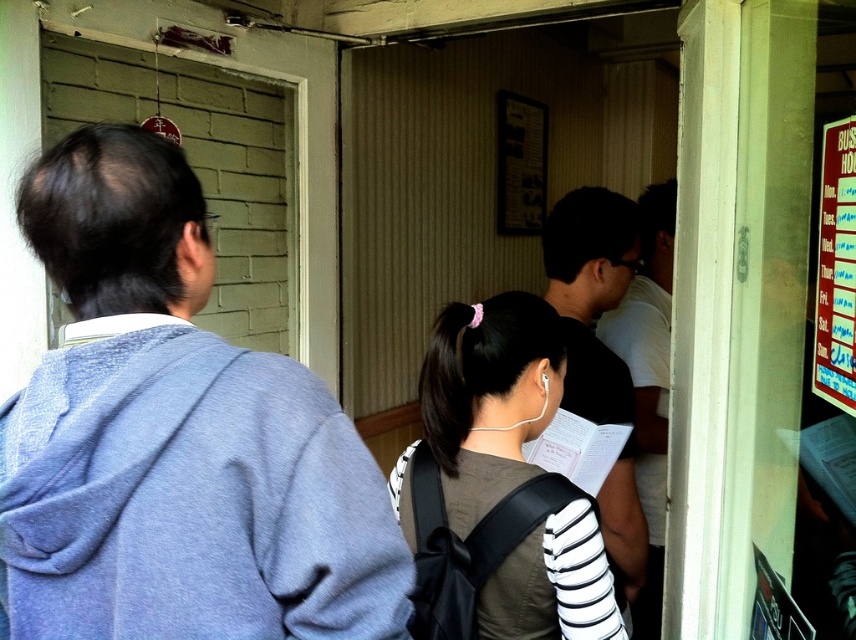
Is point (521, 554) positioned after point (581, 304)?

No, it is not.

In the scene shown: Can you confirm if dark brown hair at center is positioned to the left of black matte shirt at center?

Correct, you'll find dark brown hair at center to the left of black matte shirt at center.

Locate an element on the screen. The image size is (856, 640). dark brown hair at center is located at coordinates (497, 486).

Measure the distance between black matte shirt at center and camera.

A distance of 1.30 meters exists between black matte shirt at center and camera.

Describe the element at coordinates (591, 294) in the screenshot. This screenshot has width=856, height=640. I see `black matte shirt at center` at that location.

Does point (617, 547) come behind point (854, 257)?

Yes.

The image size is (856, 640). I want to click on black matte shirt at center, so click(x=591, y=294).

Can you confirm if light blue hoodie at left is wider than black matte shirt at center?

Indeed, light blue hoodie at left has a greater width compared to black matte shirt at center.

Who is taller, light blue hoodie at left or black matte shirt at center?

Standing taller between the two is black matte shirt at center.

This screenshot has height=640, width=856. Describe the element at coordinates (175, 440) in the screenshot. I see `light blue hoodie at left` at that location.

This screenshot has height=640, width=856. In order to click on light blue hoodie at left in this screenshot , I will do `click(175, 440)`.